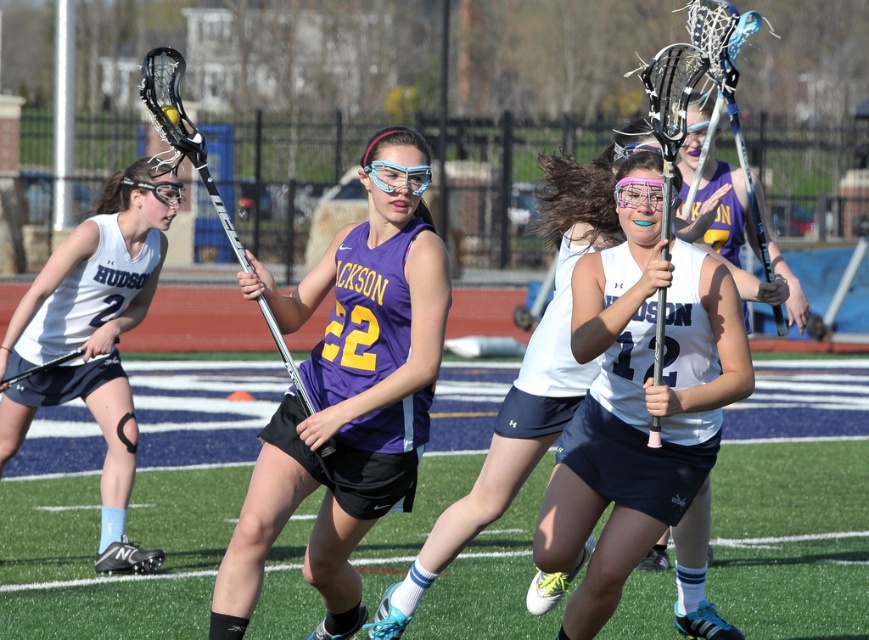
Question: Which point is closer to the camera taking this photo?

Choices:
 (A) (402, 134)
 (B) (56, 376)

Answer: (A)

Question: Which of the following is the farthest from the observer?

Choices:
 (A) pink translucent goggles at center
 (B) white matte jersey at center
 (C) transparent plastic goggles at center

Answer: (C)

Question: Which is farther from the pink translucent goggles at center?

Choices:
 (A) clear plastic goggles at center
 (B) white matte uniform at left
 (C) purple matte lacrosse stick at center

Answer: (B)

Question: Does purple matte lacrosse stick at center have a lesser width compared to pink translucent goggles at center?

Choices:
 (A) no
 (B) yes

Answer: (A)

Question: Is white matte jersey at center above transparent plastic goggles at center?

Choices:
 (A) yes
 (B) no

Answer: (B)

Question: Does white matte jersey at center lie in front of transparent plastic goggles at center?

Choices:
 (A) no
 (B) yes

Answer: (B)